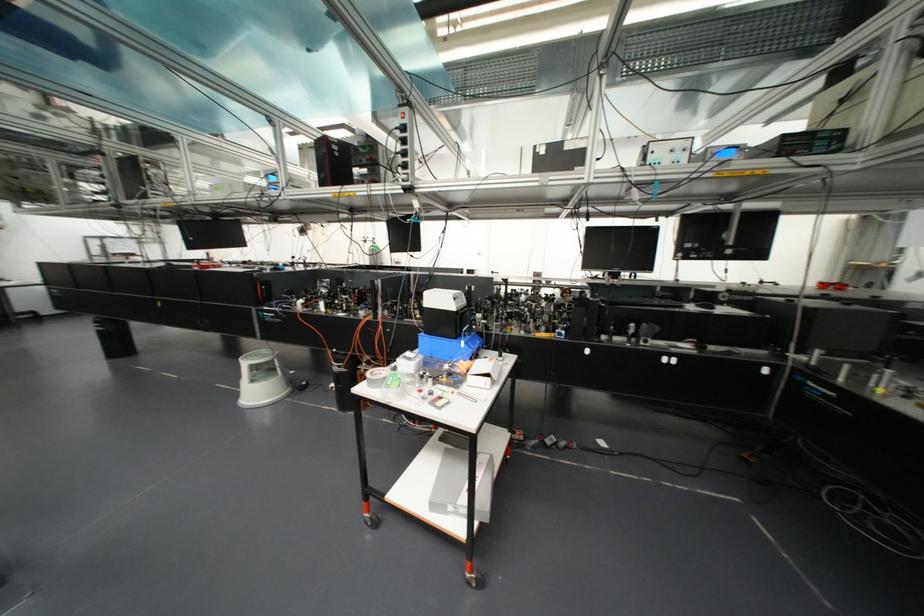
Find where to lift the blue plastic box. Please return your answer as a coordinate pair (x, y).

(448, 346)